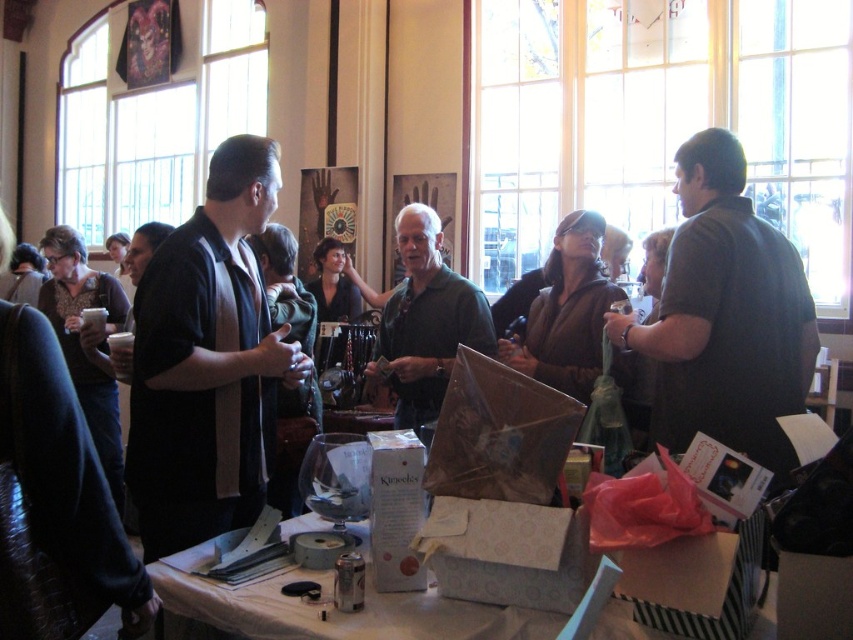
Question: Is black matte shirt at center smaller than clear glass wine glass at center?

Choices:
 (A) yes
 (B) no

Answer: (B)

Question: Which point appears closest to the camera in this image?

Choices:
 (A) pos(708,388)
 (B) pos(490,316)

Answer: (A)

Question: Does green matte shirt at center lie behind clear glass wine glass at center?

Choices:
 (A) yes
 (B) no

Answer: (A)

Question: Considering the relative positions of dark green shirt at upper right and white cardboard boxes at center in the image provided, where is dark green shirt at upper right located with respect to white cardboard boxes at center?

Choices:
 (A) above
 (B) below

Answer: (A)

Question: Which of the following is the farthest from the observer?

Choices:
 (A) clear glass wine glass at center
 (B) green matte shirt at center
 (C) dark green shirt at upper right

Answer: (B)

Question: Which of these objects is positioned closest to the white cardboard boxes at center?

Choices:
 (A) green matte shirt at center
 (B) black matte shirt at center
 (C) clear glass wine glass at center
 (D) dark green shirt at upper right

Answer: (C)